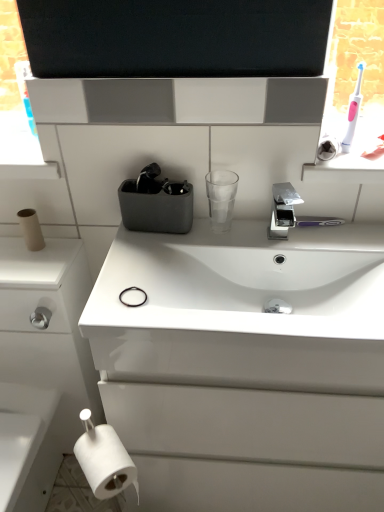
Where is `free space that is in between chrome metallic faucet at center and transparent plastic cup at center`? Image resolution: width=384 pixels, height=512 pixels. free space that is in between chrome metallic faucet at center and transparent plastic cup at center is located at coordinates (245, 237).